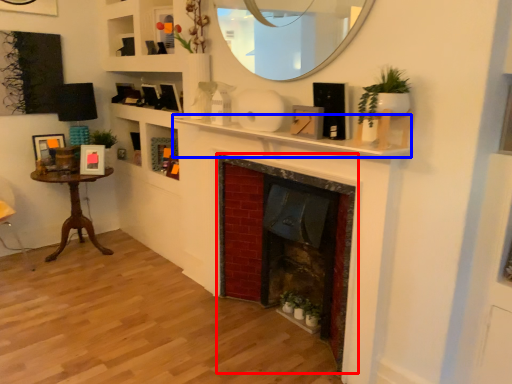
Question: Which object is closer to the camera taking this photo, fireplace (highlighted by a red box) or mantle (highlighted by a blue box)?

Choices:
 (A) fireplace
 (B) mantle

Answer: (B)